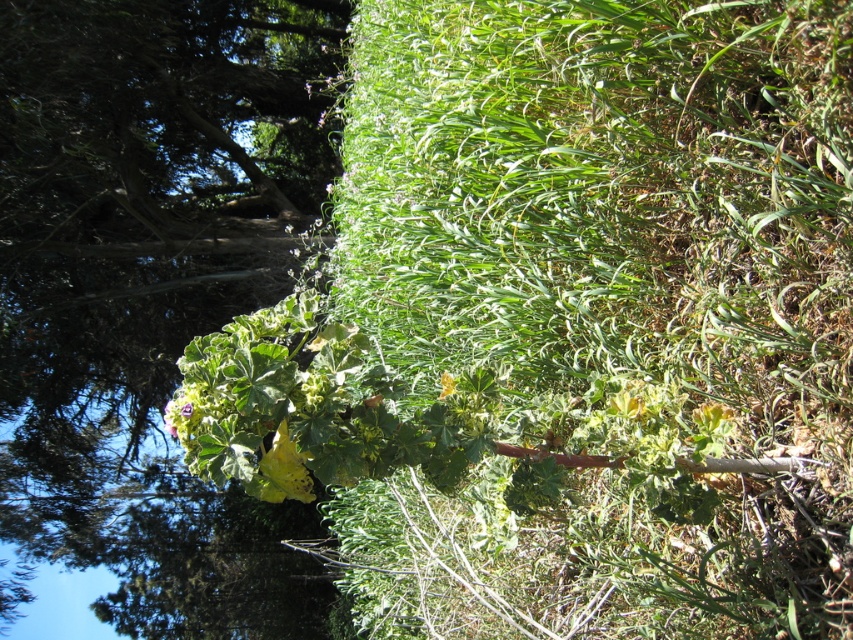
Is yellow matte leaf at center positioned before green matte leaf at center?

No, it is not.

Is point (293, 442) more distant than point (184, 412)?

That is True.

Locate an element on the screen. This screenshot has height=640, width=853. yellow matte leaf at center is located at coordinates (287, 467).

Can you confirm if yellow matte flower at center is shorter than green matte leaf at center?

No.

Who is positioned more to the left, yellow matte flower at center or green matte leaf at center?

green matte leaf at center is more to the left.

Does point (453, 384) lie in front of point (183, 412)?

That is False.

Where is `yellow matte flower at center`? yellow matte flower at center is located at coordinates (445, 385).

Identify the location of yellow matte leaf at center. (287, 467).

Image resolution: width=853 pixels, height=640 pixels. What do you see at coordinates (287, 467) in the screenshot?
I see `yellow matte leaf at center` at bounding box center [287, 467].

The height and width of the screenshot is (640, 853). In order to click on yellow matte leaf at center in this screenshot , I will do `click(287, 467)`.